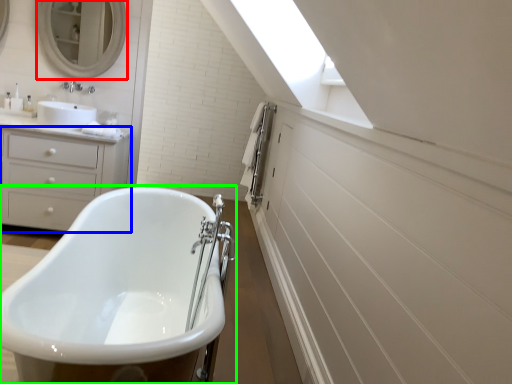
Question: Which is farther away from mirror (highlighted by a red box)? chest of drawers (highlighted by a blue box) or bathtub (highlighted by a green box)?

Choices:
 (A) chest of drawers
 (B) bathtub

Answer: (B)